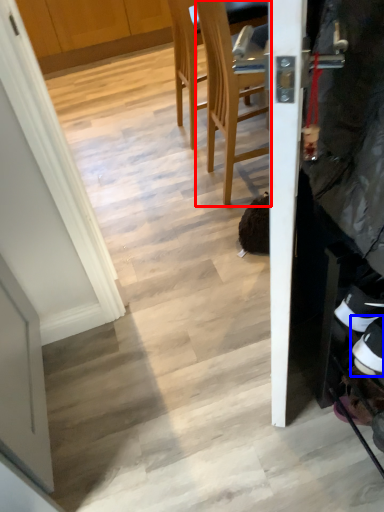
Question: Which of the following is the closest to the observer, chair (highlighted by a red box) or footwear (highlighted by a blue box)?

Choices:
 (A) chair
 (B) footwear

Answer: (B)